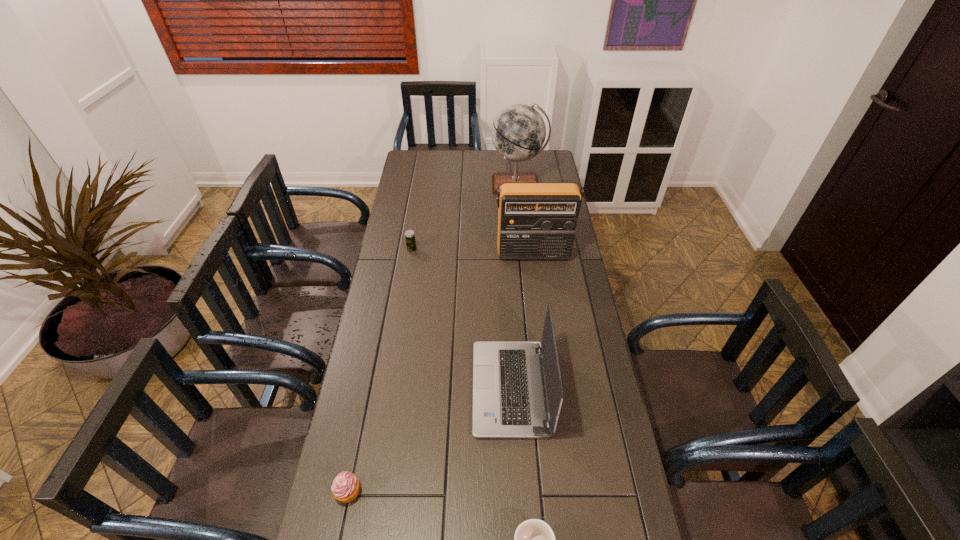
Find the location of a particular element. object situated at the far right corner is located at coordinates (518, 132).

Identify the location of free point at the far edge. This screenshot has height=540, width=960. (451, 165).

Where is `free space at the left edge of the desktop`? The width and height of the screenshot is (960, 540). free space at the left edge of the desktop is located at coordinates (379, 273).

Find the location of a particular element. The height and width of the screenshot is (540, 960). vacant region at the right edge is located at coordinates (564, 292).

Find the location of `free space between the fourth shortest object and the cupcake`. free space between the fourth shortest object and the cupcake is located at coordinates [429, 440].

Locate an element on the screen. free space that is in between the leftmost object and the farthest object is located at coordinates (433, 338).

Locate an element on the screen. free space between the leftmost object and the beer can is located at coordinates (380, 370).

Locate an element on the screen. This screenshot has width=960, height=540. free space between the second tallest object and the beer can is located at coordinates coord(472,252).

This screenshot has height=540, width=960. Find the location of `free space between the tallest object and the leftmost object`. free space between the tallest object and the leftmost object is located at coordinates (433, 338).

You are a GUI agent. You are given a task and a screenshot of the screen. Output one action in this format:
    pyautogui.click(x=<x>, y=<y>)
    Task: Click on the free space between the second tallest object and the beer can
    
    Given the screenshot: What is the action you would take?
    pyautogui.click(x=472, y=252)